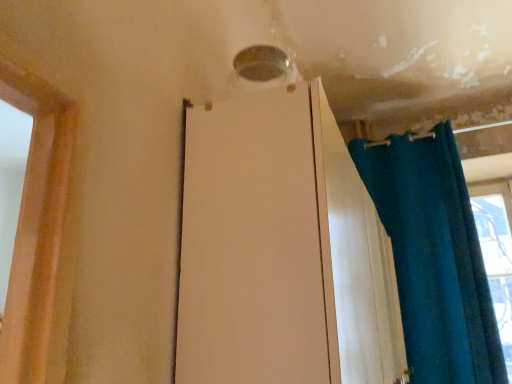
Question: From a real-world perspective, is teal fabric curtain at right located higher than white matte screen door at center?

Choices:
 (A) yes
 (B) no

Answer: (A)

Question: Does teal fabric curtain at right lie in front of white matte screen door at center?

Choices:
 (A) yes
 (B) no

Answer: (B)

Question: From the image's perspective, is teal fabric curtain at right below white matte screen door at center?

Choices:
 (A) yes
 (B) no

Answer: (B)

Question: Is teal fabric curtain at right wider than white matte screen door at center?

Choices:
 (A) yes
 (B) no

Answer: (B)

Question: Is teal fabric curtain at right behind white matte screen door at center?

Choices:
 (A) yes
 (B) no

Answer: (A)

Question: Is teal fabric curtain at right positioned with its back to white matte screen door at center?

Choices:
 (A) yes
 (B) no

Answer: (B)

Question: Is white matte screen door at center next to teal fabric curtain at right and touching it?

Choices:
 (A) yes
 (B) no

Answer: (B)

Question: From the image's perspective, is white matte screen door at center below teal fabric curtain at right?

Choices:
 (A) yes
 (B) no

Answer: (A)

Question: Is white matte screen door at center at the right side of teal fabric curtain at right?

Choices:
 (A) yes
 (B) no

Answer: (B)

Question: Does white matte screen door at center appear on the left side of teal fabric curtain at right?

Choices:
 (A) yes
 (B) no

Answer: (A)

Question: Does white matte screen door at center come behind teal fabric curtain at right?

Choices:
 (A) no
 (B) yes

Answer: (A)

Question: Is white matte screen door at center wider than teal fabric curtain at right?

Choices:
 (A) yes
 (B) no

Answer: (A)

Question: From a real-world perspective, is white matte screen door at center physically located above or below teal fabric curtain at right?

Choices:
 (A) below
 (B) above

Answer: (A)